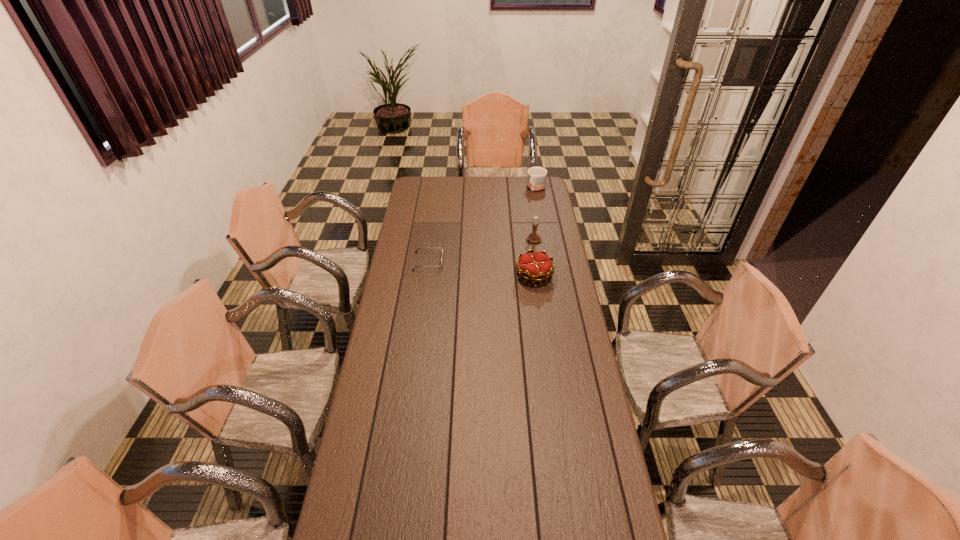
At what (x,y) coordinates should I click in order to perform the action: click on vacant space in between the leftmost object and the tallest object. Please return your answer as a coordinate pair (x, y). Looking at the image, I should click on (481, 251).

Locate an element on the screen. This screenshot has height=540, width=960. vacant area that lies between the sunglasses and the candle holder is located at coordinates (481, 251).

In order to click on vacant area that lies between the sunglasses and the farthest object in this screenshot , I will do `click(482, 225)`.

The height and width of the screenshot is (540, 960). Find the location of `object that ranks as the third closest to the crown`. object that ranks as the third closest to the crown is located at coordinates (536, 178).

Locate an element on the screen. This screenshot has height=540, width=960. object that can be found as the closest to the tallest object is located at coordinates (536, 266).

I want to click on vacant space that satisfies the following two spatial constraints: 1. on the back side of the candle holder; 2. on the left side of the mug, so click(526, 188).

Locate an element on the screen. The height and width of the screenshot is (540, 960). free space in the image that satisfies the following two spatial constraints: 1. on the back side of the candle holder; 2. on the left side of the farthest object is located at coordinates (526, 188).